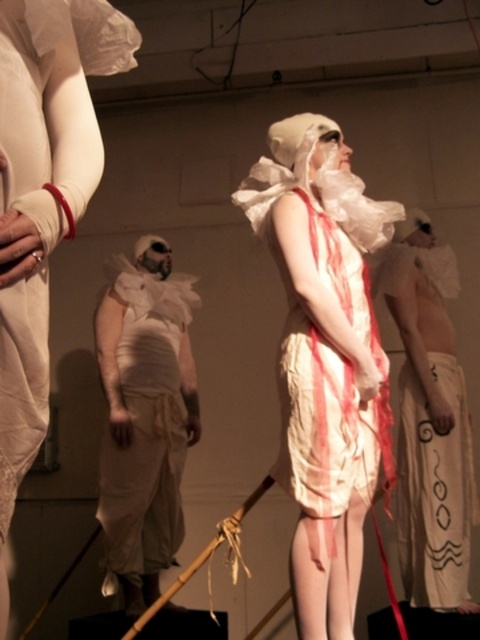
Question: Is matte white fabric at center positioned behind white crumpled cloth at center?

Choices:
 (A) no
 (B) yes

Answer: (A)

Question: Among these objects, which one is farthest from the camera?

Choices:
 (A) matte white fabric at center
 (B) matte white cloth at center
 (C) white textured cloth at center
 (D) white crumpled cloth at center

Answer: (D)

Question: Which point is farther to the camera?

Choices:
 (A) matte white fabric at center
 (B) white crumpled cloth at center

Answer: (B)

Question: Does white crumpled cloth at center appear on the left side of white textured cloth at center?

Choices:
 (A) no
 (B) yes

Answer: (B)

Question: Among these points, which one is nearest to the camera?

Choices:
 (A) (400, 416)
 (B) (338, 305)
 (C) (154, 362)

Answer: (B)

Question: Is matte white cloth at center further to the viewer compared to white textured cloth at center?

Choices:
 (A) no
 (B) yes

Answer: (A)